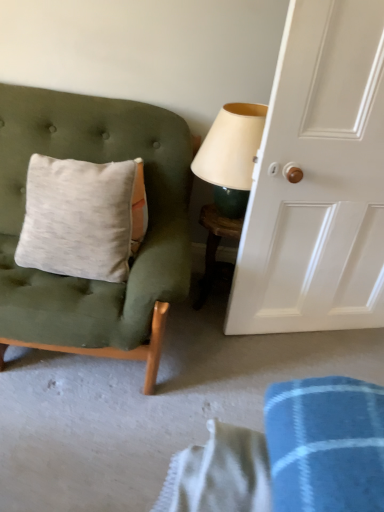
Question: Based on their positions, is velvet green chair at left located to the left or right of matte cream lampshade at upper right?

Choices:
 (A) right
 (B) left

Answer: (B)

Question: In terms of size, does velvet green chair at left appear bigger or smaller than matte cream lampshade at upper right?

Choices:
 (A) big
 (B) small

Answer: (A)

Question: Estimate the real-world distances between objects in this image. Which object is farther from the velvet green chair at left?

Choices:
 (A) white glossy door at right
 (B) wooden table at center
 (C) matte cream lampshade at upper right

Answer: (A)

Question: Which object is the farthest from the velvet green chair at left?

Choices:
 (A) white glossy door at right
 (B) matte cream lampshade at upper right
 (C) wooden table at center

Answer: (A)